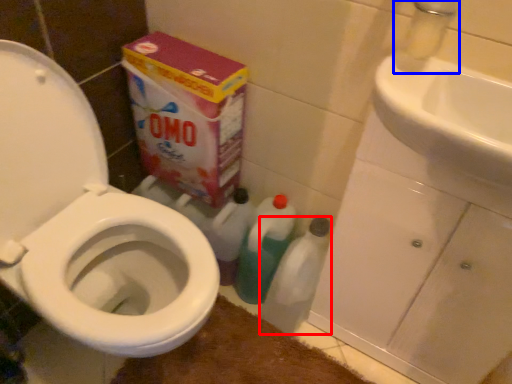
Question: Which point is further to the camera, cleaning product (highlighted by a red box) or faucet (highlighted by a blue box)?

Choices:
 (A) cleaning product
 (B) faucet

Answer: (A)